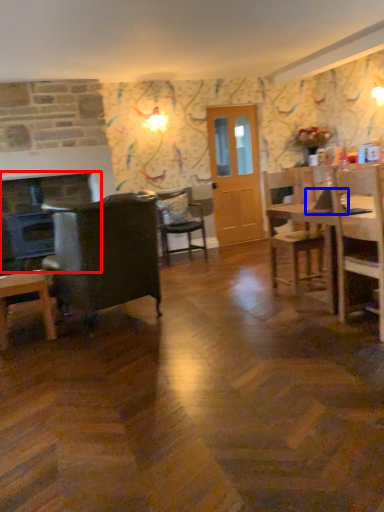
Question: Which object is closer to the camera taking this photo, fireplace (highlighted by a red box) or laptop (highlighted by a blue box)?

Choices:
 (A) fireplace
 (B) laptop

Answer: (B)